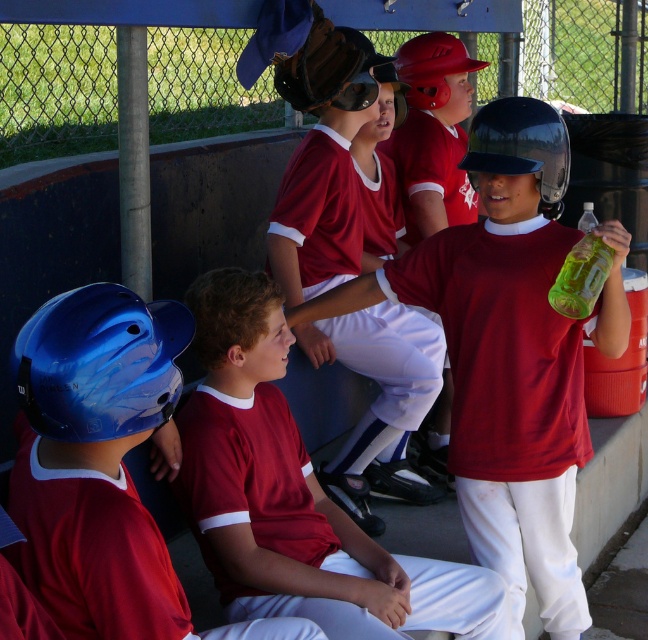
Which of these two, matte blue helmet at center or brown leather glove at upper center, stands shorter?

brown leather glove at upper center

Which is in front, point (65, 330) or point (332, 81)?

Positioned in front is point (65, 330).

The width and height of the screenshot is (648, 640). I want to click on matte blue helmet at center, so click(102, 467).

Is the position of shiny red helmet at center less distant than that of brown leather glove at upper center?

Yes, it is.

Is shiny red helmet at center below brown leather glove at upper center?

Correct, shiny red helmet at center is located below brown leather glove at upper center.

The image size is (648, 640). I want to click on shiny red helmet at center, so click(x=503, y=356).

Find the location of a particular element. The width and height of the screenshot is (648, 640). shiny red helmet at center is located at coordinates (503, 356).

Is point (527, 360) more distant than point (364, 522)?

No, (527, 360) is in front of (364, 522).

Who is more distant from viewer, (492, 177) or (351, 100)?

The point (351, 100) is behind.

Find the location of a particular element. shiny red helmet at center is located at coordinates (503, 356).